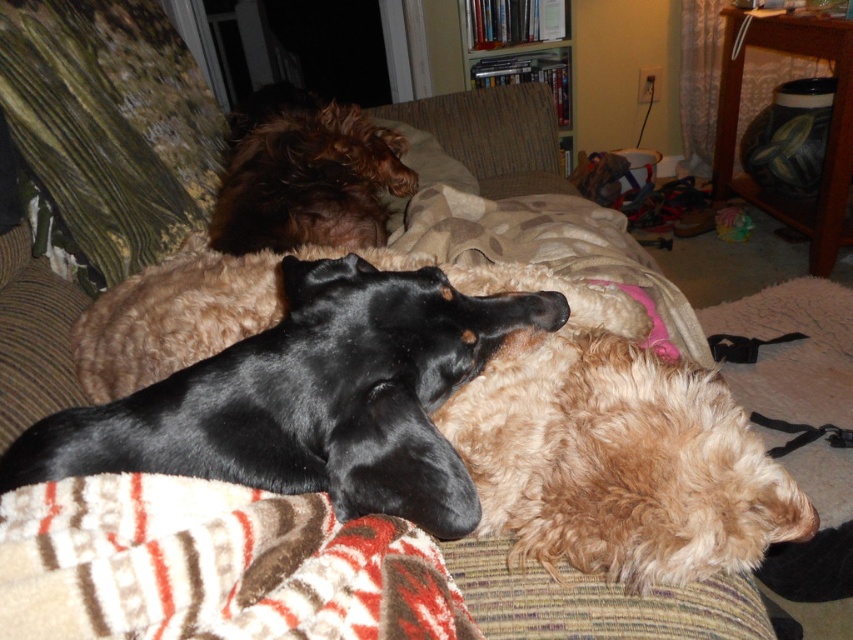
Question: Which point is closer to the camera?

Choices:
 (A) shaggy brown dog at upper center
 (B) fuzzy beige pillow at upper center
 (C) fuzzy brown dog at center

Answer: (C)

Question: Estimate the real-world distances between objects in this image. Which object is closer to the black smooth dog at center?

Choices:
 (A) shaggy brown dog at upper center
 (B) fuzzy brown dog at center
 (C) fuzzy beige pillow at upper center

Answer: (B)

Question: Does black smooth dog at center have a greater width compared to fuzzy beige pillow at upper center?

Choices:
 (A) yes
 (B) no

Answer: (A)

Question: Is fuzzy brown dog at center to the right of shaggy brown dog at upper center from the viewer's perspective?

Choices:
 (A) yes
 (B) no

Answer: (A)

Question: Which object is closer to the camera taking this photo?

Choices:
 (A) black smooth dog at center
 (B) fuzzy beige pillow at upper center
 (C) shaggy brown dog at upper center

Answer: (A)

Question: Considering the relative positions of fuzzy brown dog at center and fuzzy beige pillow at upper center in the image provided, where is fuzzy brown dog at center located with respect to fuzzy beige pillow at upper center?

Choices:
 (A) above
 (B) below

Answer: (B)